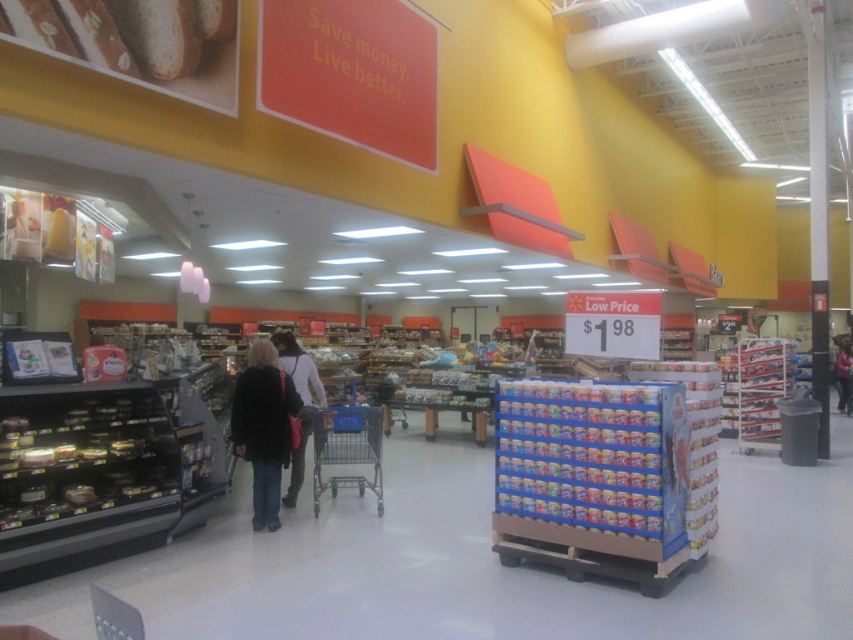
You are a Walmart employee who needs to place the black fabric jacket at center and the blue metal shopping cart at center in a storage area. Since the storage area has a width limit of 1 meter, which item will fit through the entrance without needing to be turned sideways?

The black fabric jacket at center has a lesser width compared to the blue metal shopping cart at center, so the black fabric jacket at center will fit through the entrance without needing to be turned sideways.

You are a customer in the Walmart deli section and need to place a black fabric purse at center onto a shelf. The shelf has a designated spot at point 0.5 on the horizontal axis. Is the purse already positioned correctly?

The black fabric purse at center is located at point 0.577 on the horizontal axis, which is slightly to the right of the designated 0.5 spot. Therefore, it needs to be moved slightly to the left to align with the correct position.